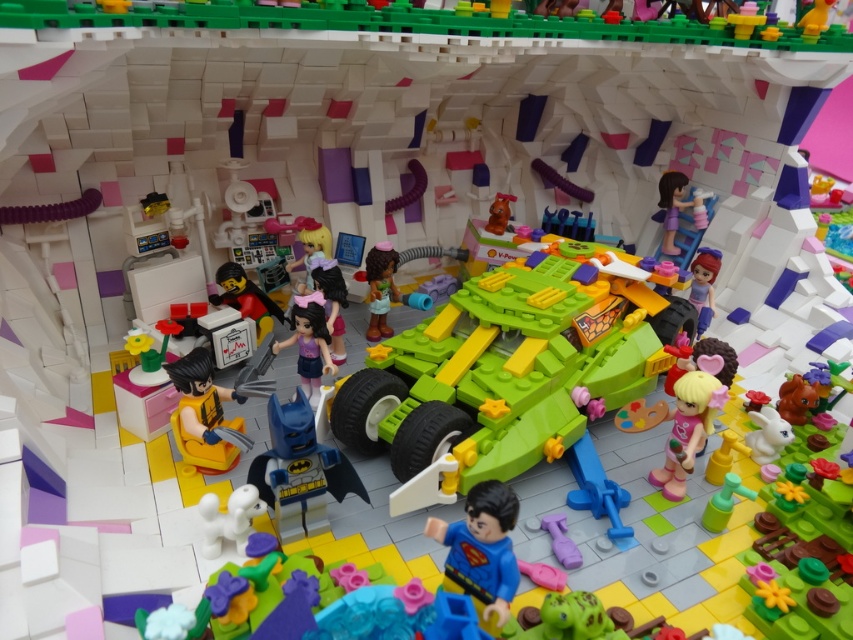
Question: Among these objects, which one is farthest from the camera?

Choices:
 (A) smooth purple dress at upper right
 (B) purple matte dress at center
 (C) green plastic watering can at center-left

Answer: (A)

Question: Is shiny blue plastic batman at center bigger than purple matte dress at center?

Choices:
 (A) yes
 (B) no

Answer: (B)

Question: Does smooth blue suit at center have a smaller size compared to matte black figure at center-left?

Choices:
 (A) no
 (B) yes

Answer: (B)

Question: Does shiny blue plastic batman at center have a smaller size compared to pastel pink fabric doll at center right?

Choices:
 (A) yes
 (B) no

Answer: (B)

Question: Among these points, which one is farthest from the camera?

Choices:
 (A) (161, 381)
 (B) (463, 528)
 (C) (698, 256)
 (D) (370, 288)

Answer: (C)

Question: Which object is positioned closest to the shiny blue plastic batman at center?

Choices:
 (A) matte black figure at center-left
 (B) smooth black hair at center
 (C) smooth purple dress at upper right

Answer: (B)